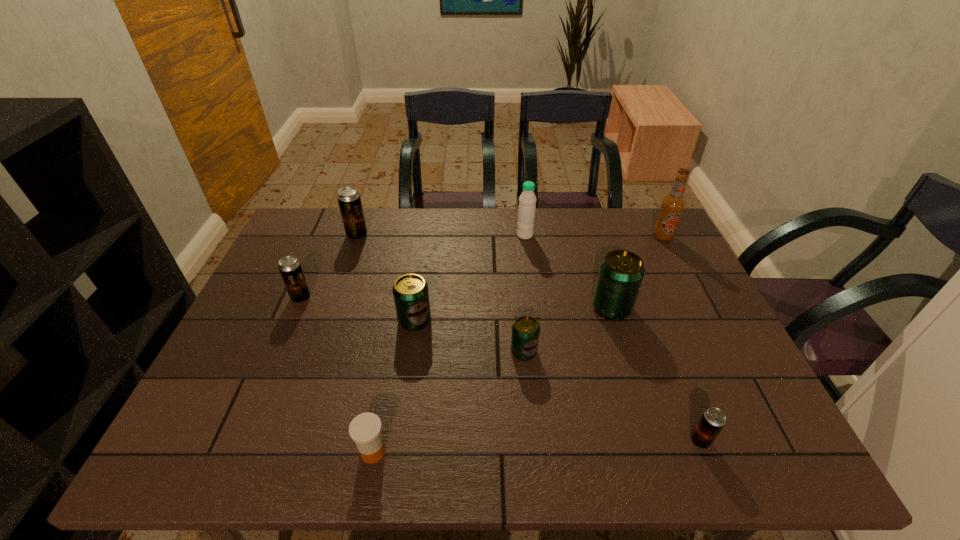
The height and width of the screenshot is (540, 960). Find the location of `vacant area at the near right corner`. vacant area at the near right corner is located at coordinates click(782, 443).

The image size is (960, 540). I want to click on vacant area that lies between the beer bottle and the leftmost black beer can, so click(x=482, y=267).

Identify the location of free spot between the nearest green beer can and the biggest green beer can. (567, 329).

You are a GUI agent. You are given a task and a screenshot of the screen. Output one action in this format:
    pyautogui.click(x=<x>, y=<y>)
    Task: Click on the free point between the leftmost object and the water bottle
    This screenshot has height=540, width=960.
    Given the screenshot: What is the action you would take?
    pyautogui.click(x=413, y=266)

The image size is (960, 540). Identify the location of vacant region between the second green beer can from left to right and the farthest black beer can. (441, 293).

You are a GUI agent. You are given a task and a screenshot of the screen. Output one action in this format:
    pyautogui.click(x=<x>, y=<y>)
    Task: Click on the vacant area that lies between the medicine and the biggest black beer can
    This screenshot has width=960, height=540.
    Given the screenshot: What is the action you would take?
    pyautogui.click(x=365, y=343)

You are a GUI agent. You are given a task and a screenshot of the screen. Output one action in this format:
    pyautogui.click(x=<x>, y=<y>)
    Task: Click on the vacant area that lies between the nearest black beer can and the white water bottle
    The height and width of the screenshot is (540, 960).
    Given the screenshot: What is the action you would take?
    pyautogui.click(x=612, y=338)

You are a GUI agent. You are given a task and a screenshot of the screen. Output one action in this format:
    pyautogui.click(x=<x>, y=<y>)
    Task: Click on the vacant area that lies between the fifth beer can from right to left and the medicine
    The width and height of the screenshot is (960, 540).
    Given the screenshot: What is the action you would take?
    pyautogui.click(x=365, y=343)

Locate an element on the screen. free spot between the rightmost green beer can and the farthest beer can is located at coordinates (484, 272).

At what (x,y) coordinates should I click in order to perform the action: click on free space that is in between the rightmost object and the second farthest black beer can. Please return your answer as a coordinate pair (x, y). The width and height of the screenshot is (960, 540). Looking at the image, I should click on (482, 267).